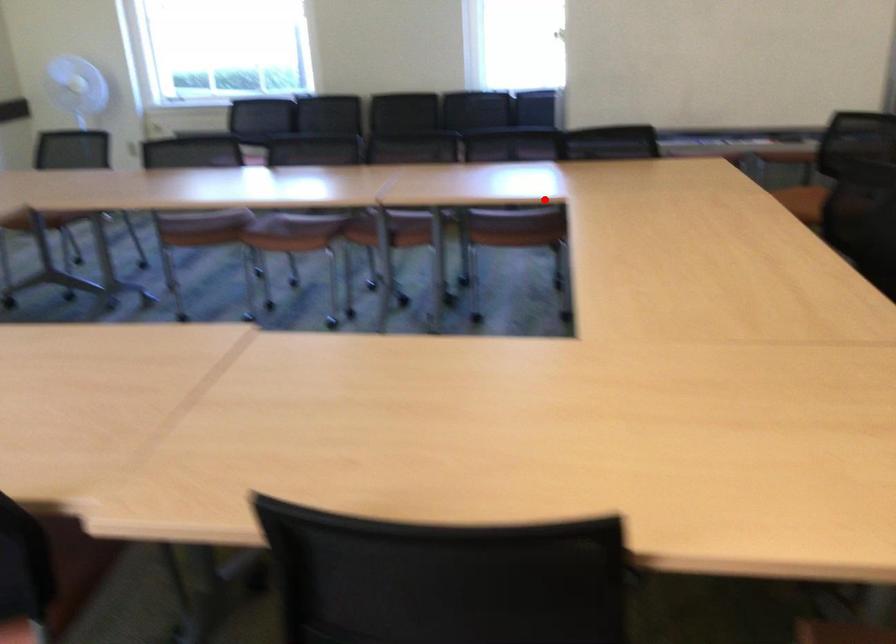
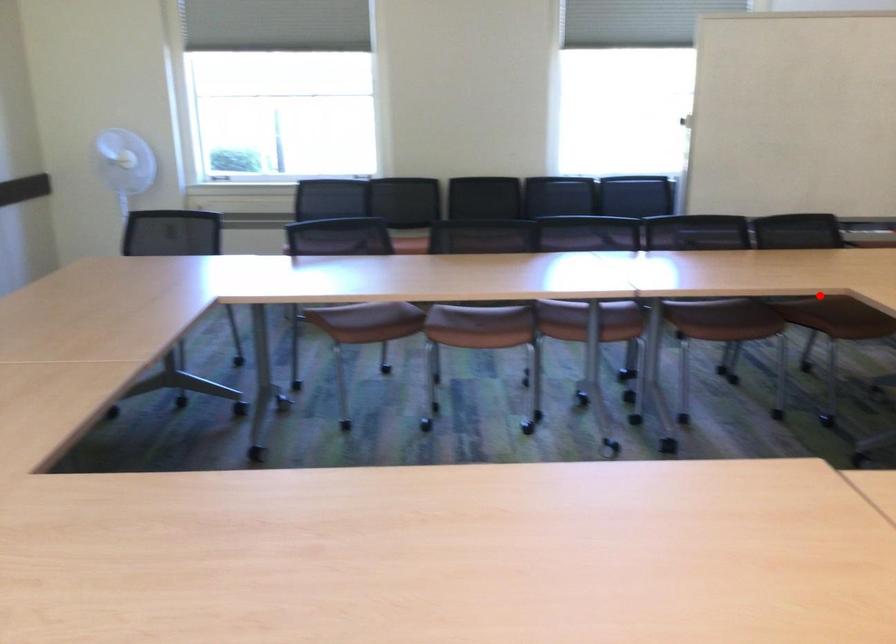
I am providing you with two images of the same scene from different viewpoints. A red point is marked on the first image and another point is marked on the second image. Does the point marked in image1 correspond to the same location as the one in image2?

Yes